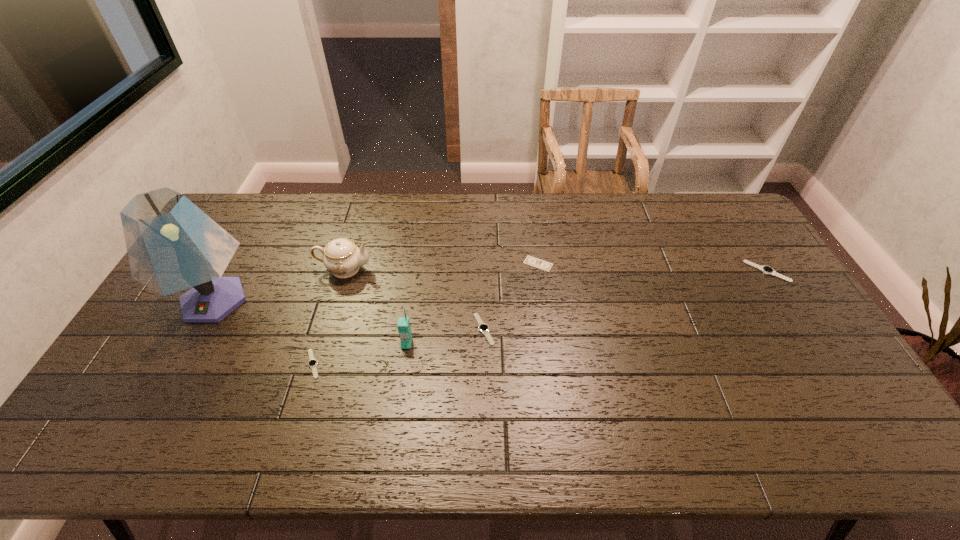
Locate an element on the screen. free space between the cellular telephone and the money is located at coordinates (472, 303).

Locate an element on the screen. The image size is (960, 540). free space between the leftmost object and the shortest watch is located at coordinates (264, 332).

In order to click on free area in between the shortest watch and the fourth shortest object in this screenshot , I will do `click(540, 318)`.

Locate an element on the screen. The height and width of the screenshot is (540, 960). empty space between the chinaware and the third object from right to left is located at coordinates (414, 299).

The height and width of the screenshot is (540, 960). What are the coordinates of `free space between the leftmost object and the leftmost watch` in the screenshot? It's located at (264, 332).

Where is `free space between the tallest watch and the shortest watch`? The image size is (960, 540). free space between the tallest watch and the shortest watch is located at coordinates (540, 318).

Identify which object is the sixth closest to the cellular telephone. Please provide its 2D coordinates. Your answer should be formatted as a tuple, i.e. [(x, y)], where the tuple contains the x and y coordinates of a point satisfying the conditions above.

[(767, 270)]

Find the location of a particular element. The image size is (960, 540). object that is the fourth closest one to the cellular telephone is located at coordinates (532, 261).

Choose which watch is the third nearest neighbor to the shortest object. Please provide its 2D coordinates. Your answer should be formatted as a tuple, i.e. [(x, y)], where the tuple contains the x and y coordinates of a point satisfying the conditions above.

[(312, 363)]

The image size is (960, 540). I want to click on watch identified as the second closest to the second watch from left to right, so click(x=767, y=270).